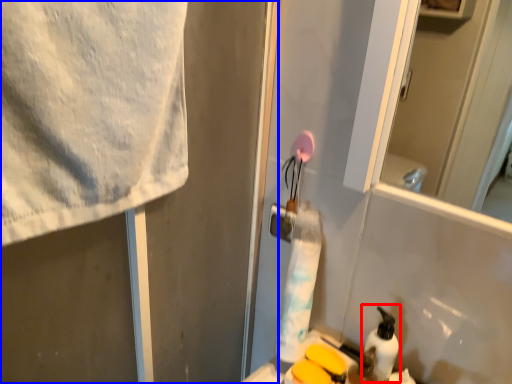
Question: Which object is further to the camera taking this photo, cleaning product (highlighted by a red box) or screen door (highlighted by a blue box)?

Choices:
 (A) cleaning product
 (B) screen door

Answer: (A)